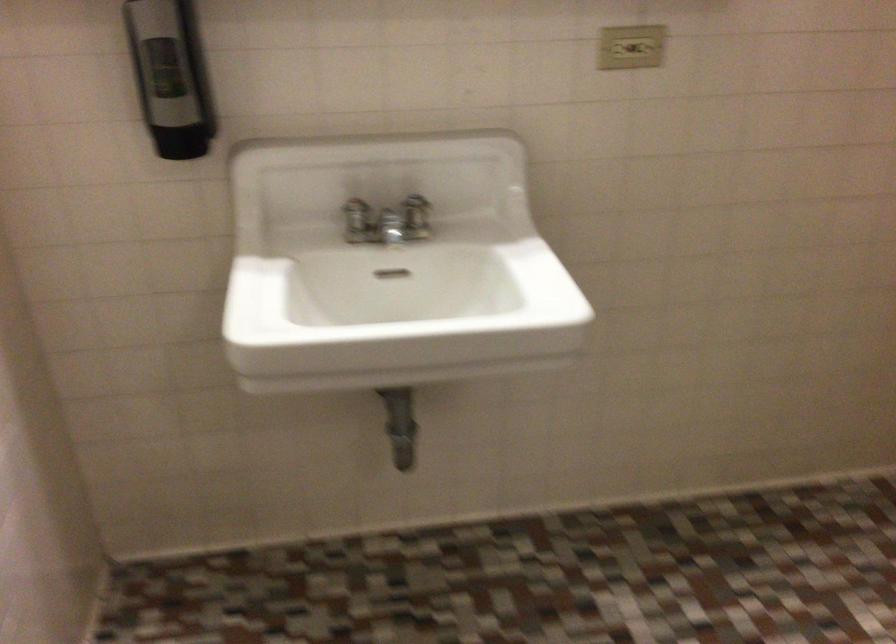
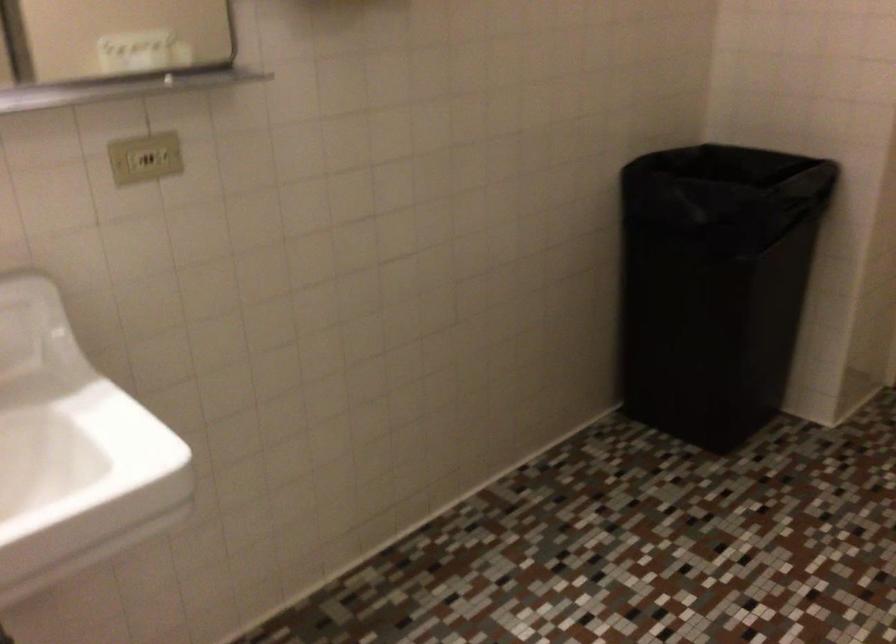
Question: The camera is either moving clockwise (left) or counter-clockwise (right) around the object. The first image is from the beginning of the video and the second image is from the end. Is the camera moving left or right when shooting the video?

Choices:
 (A) Left
 (B) Right

Answer: (A)